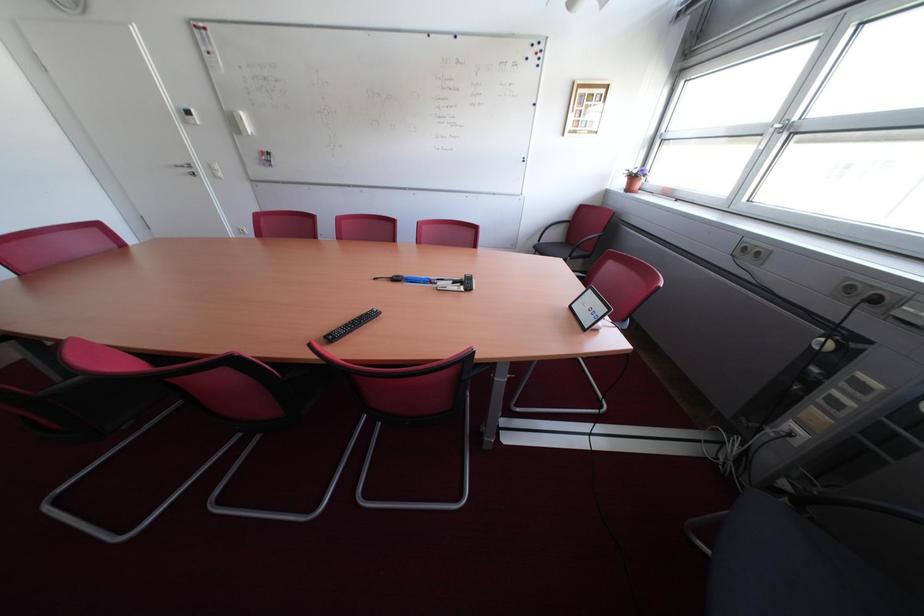
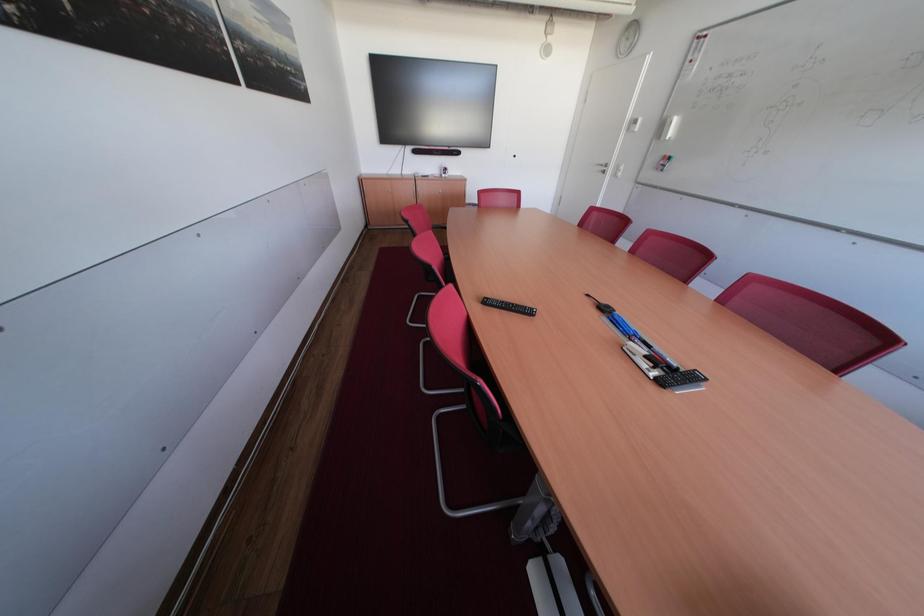
The images are taken continuously from a first-person perspective. In which direction is your viewpoint rotating?

The camera rotated toward left-down.